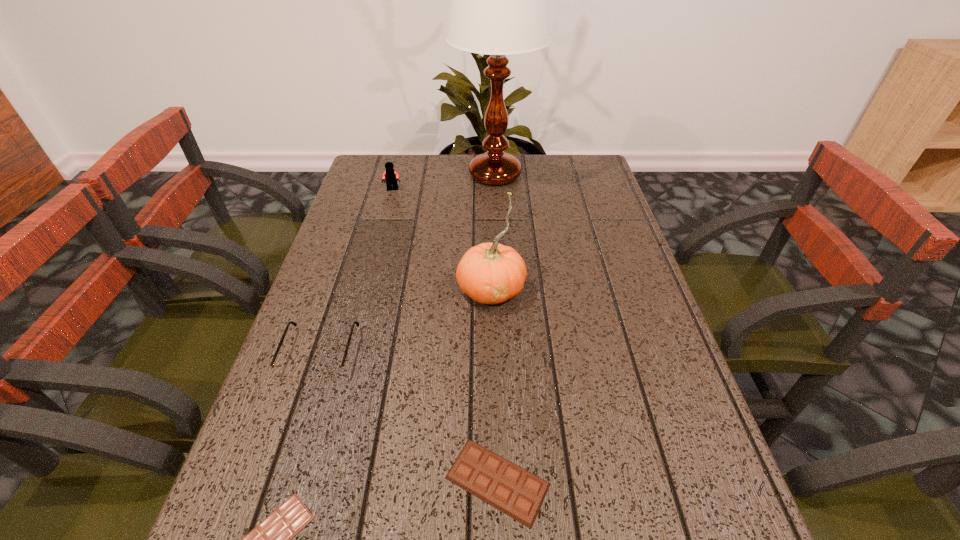
At what (x,y) coordinates should I click in order to perform the action: click on free spot at the right edge of the desktop. Please return your answer as a coordinate pair (x, y). This screenshot has width=960, height=540. Looking at the image, I should click on pyautogui.click(x=683, y=495).

This screenshot has width=960, height=540. Identify the location of free space at the far left corner of the desktop. (369, 171).

In the image, there is a desktop. Identify the location of vacant space at the far right corner. This screenshot has width=960, height=540. (574, 159).

The height and width of the screenshot is (540, 960). What are the coordinates of `free space between the fifth tallest object and the third shortest object` in the screenshot? It's located at tap(409, 417).

Where is `free spot between the taller chocolate bar and the spectacles`? The height and width of the screenshot is (540, 960). free spot between the taller chocolate bar and the spectacles is located at coordinates (409, 417).

The width and height of the screenshot is (960, 540). I want to click on vacant space that's between the pumpkin and the third tallest object, so click(442, 239).

This screenshot has width=960, height=540. I want to click on unoccupied position between the fifth shortest object and the right chocolate bar, so click(494, 385).

Locate an element on the screen. The width and height of the screenshot is (960, 540). vacant space that is in between the spectacles and the pumpkin is located at coordinates (405, 321).

At what (x,y) coordinates should I click in order to perform the action: click on the closest object to the fourth farthest object. Please return your answer as a coordinate pair (x, y). Looking at the image, I should click on (271, 539).

Identify which object is the fourth closest to the Lego. Please provide its 2D coordinates. Your answer should be formatted as a tuple, i.e. [(x, y)], where the tuple contains the x and y coordinates of a point satisfying the conditions above.

[(518, 493)]